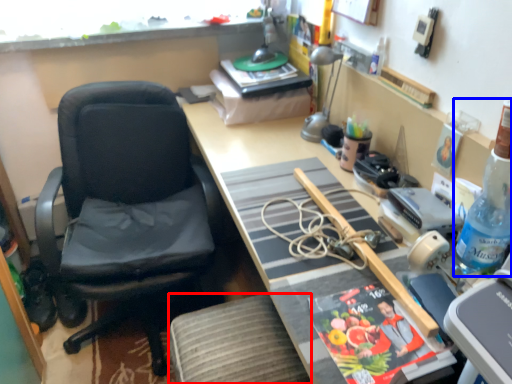
Question: Which object is further to the camera taking this photo, stool (highlighted by a red box) or bottle (highlighted by a blue box)?

Choices:
 (A) stool
 (B) bottle

Answer: (A)